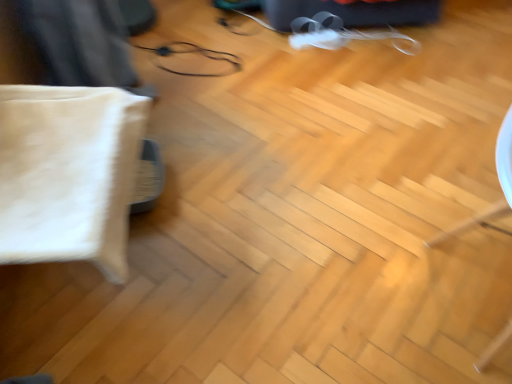
Question: Would you say metallic wire at center is to the left or to the right of white fabric pillow at left in the picture?

Choices:
 (A) left
 (B) right

Answer: (B)

Question: Is metallic wire at center inside or outside of white fabric pillow at left?

Choices:
 (A) outside
 (B) inside

Answer: (A)

Question: From the image's perspective, is metallic wire at center above or below white fabric pillow at left?

Choices:
 (A) below
 (B) above

Answer: (B)

Question: From the image's perspective, is white fabric pillow at left above or below metallic wire at center?

Choices:
 (A) above
 (B) below

Answer: (B)

Question: Is white fabric pillow at left to the left or to the right of metallic wire at center in the image?

Choices:
 (A) left
 (B) right

Answer: (A)

Question: From their relative heights in the image, would you say white fabric pillow at left is taller or shorter than metallic wire at center?

Choices:
 (A) tall
 (B) short

Answer: (A)

Question: Does point (10, 170) appear closer or farther from the camera than point (234, 59)?

Choices:
 (A) closer
 (B) farther

Answer: (A)